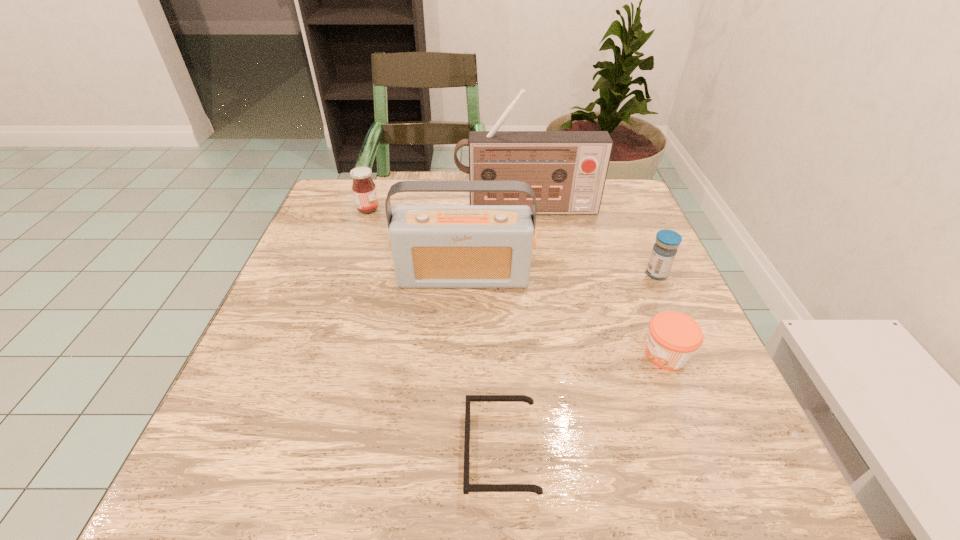
At what (x,y) coordinates should I click in order to perform the action: click on free space located 0.050m on the front-facing side of the nearest object. Please return your answer as a coordinate pair (x, y). This screenshot has width=960, height=540. Looking at the image, I should click on (432, 450).

The width and height of the screenshot is (960, 540). Identify the location of radio receiver that is at the far edge. (567, 170).

Locate an element on the screen. jam that is at the far edge is located at coordinates (364, 190).

Where is `object that is at the near edge`? object that is at the near edge is located at coordinates (467, 487).

The height and width of the screenshot is (540, 960). What are the coordinates of `object that is at the left edge` in the screenshot? It's located at (364, 190).

At what (x,y) coordinates should I click in order to perform the action: click on radio receiver situated at the right edge. Please return your answer as a coordinate pair (x, y). Image resolution: width=960 pixels, height=540 pixels. Looking at the image, I should click on (567, 170).

Find the location of `medicine located at the right edge`. medicine located at the right edge is located at coordinates (664, 251).

Locate an element on the screen. Image resolution: width=960 pixels, height=540 pixels. jam located at the right edge is located at coordinates (673, 338).

Locate an element on the screen. The width and height of the screenshot is (960, 540). object that is at the far left corner is located at coordinates (364, 190).

At what (x,y) coordinates should I click in order to perform the action: click on object positioned at the far right corner. Please return your answer as a coordinate pair (x, y). This screenshot has height=540, width=960. Looking at the image, I should click on (567, 170).